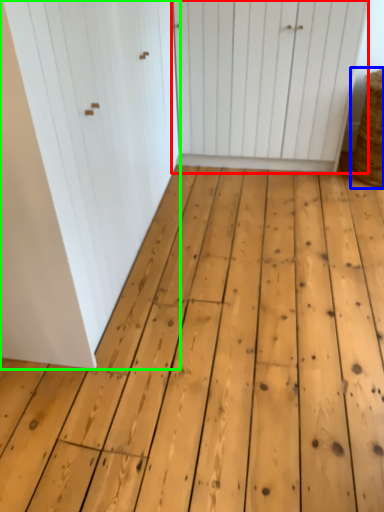
Question: Which is nearer to the door (highlighted by a red box)? basket (highlighted by a blue box) or door (highlighted by a green box).

Choices:
 (A) basket
 (B) door

Answer: (A)